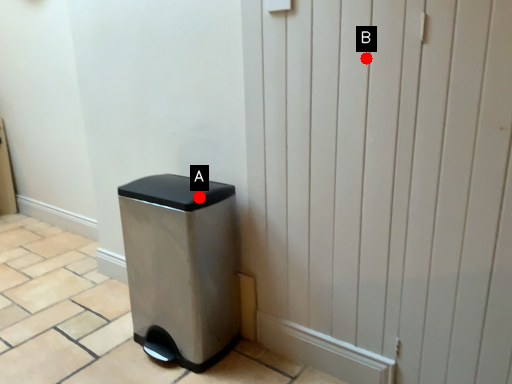
Question: Two points are circled on the image, labeled by A and B beside each circle. Which point is closer to the camera taking this photo?

Choices:
 (A) A is closer
 (B) B is closer

Answer: (B)